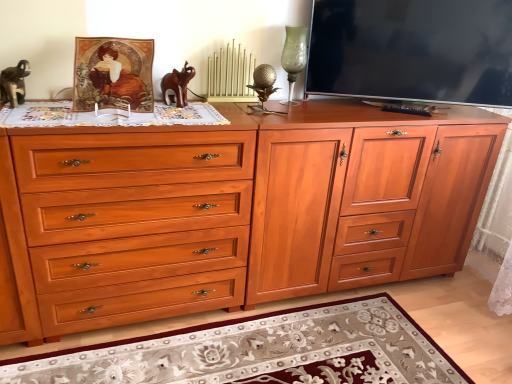
This screenshot has width=512, height=384. I want to click on empty space that is ontop of shiny wood drawer at center (from a real-world perspective), so click(x=118, y=112).